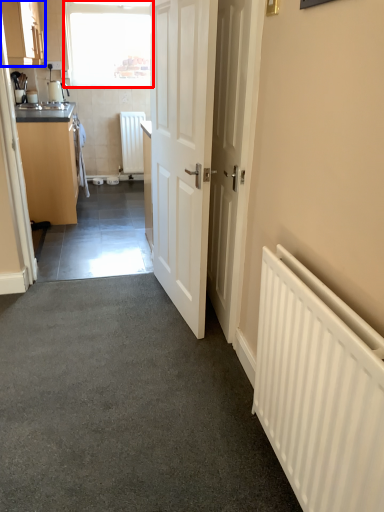
Question: Which object is further to the camera taking this photo, window (highlighted by a red box) or cabinetry (highlighted by a blue box)?

Choices:
 (A) window
 (B) cabinetry

Answer: (A)